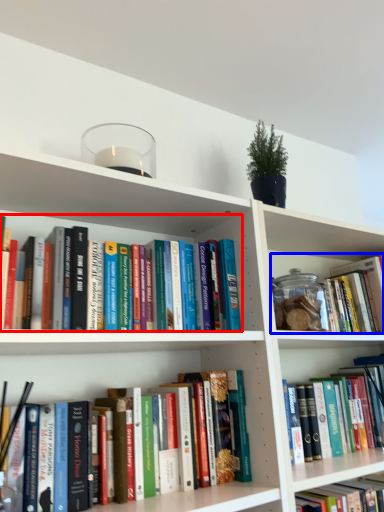
Question: Which point is further to the camera, book (highlighted by a red box) or book (highlighted by a blue box)?

Choices:
 (A) book
 (B) book

Answer: (B)